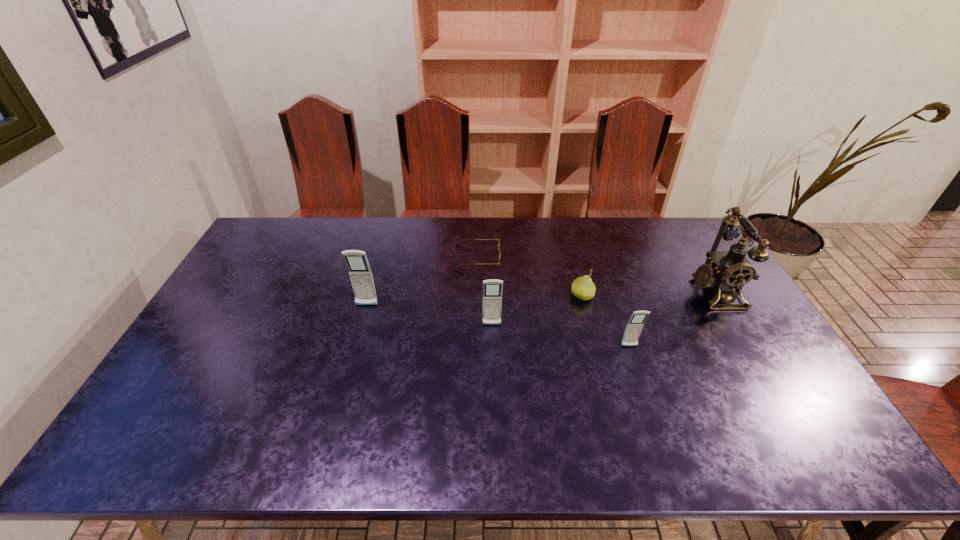
The width and height of the screenshot is (960, 540). Identify the location of object that is at the right edge. (729, 270).

The width and height of the screenshot is (960, 540). What are the coordinates of `free space at the far edge of the desktop` in the screenshot? It's located at (538, 218).

Find the location of a particular element. This screenshot has height=540, width=960. free space at the near edge of the desktop is located at coordinates (406, 390).

This screenshot has width=960, height=540. In order to click on vacant region at the left edge of the desktop in this screenshot , I will do `click(250, 260)`.

I want to click on free space at the right edge, so click(x=733, y=344).

In the image, there is a desktop. Where is `blank space at the far left corner`? Image resolution: width=960 pixels, height=540 pixels. blank space at the far left corner is located at coordinates (286, 230).

In the image, there is a desktop. Find the location of `free space at the far right corner`. free space at the far right corner is located at coordinates (661, 234).

In the image, there is a desktop. Where is `vacant space at the near right corner`? The image size is (960, 540). vacant space at the near right corner is located at coordinates (762, 417).

What are the coordinates of `free space between the telephone and the second cellular telephone from right to left` in the screenshot? It's located at pos(603,308).

Where is `vacant area that lies between the nearest cellular telephone and the third object from right to left`? This screenshot has width=960, height=540. vacant area that lies between the nearest cellular telephone and the third object from right to left is located at coordinates (606, 321).